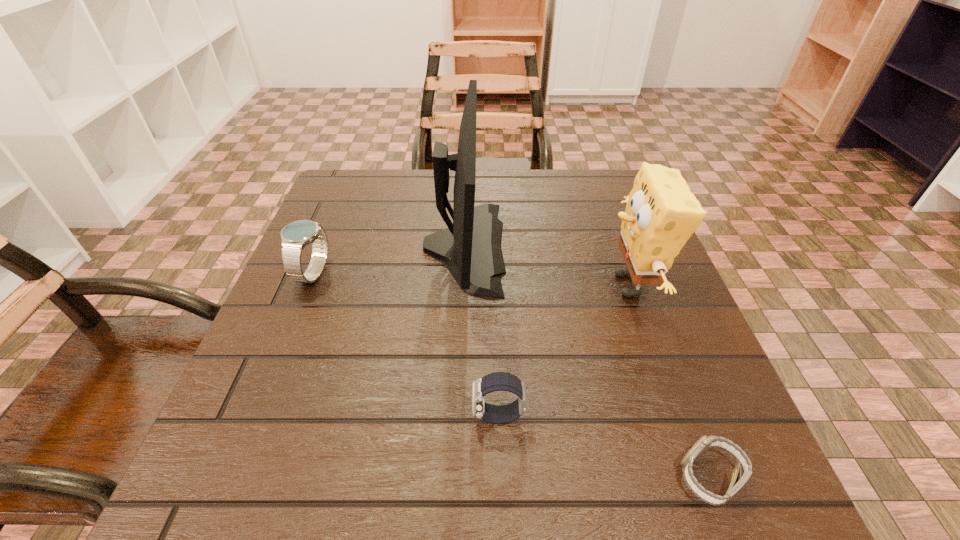
The image size is (960, 540). I want to click on the fourth closest object relative to the shortest object, so click(295, 236).

At what (x,y) coordinates should I click in order to perform the action: click on watch identified as the closest to the monitor. Please return your answer as a coordinate pair (x, y). The height and width of the screenshot is (540, 960). Looking at the image, I should click on (497, 381).

Identify which watch is located as the nearest to the leftmost watch. Please provide its 2D coordinates. Your answer should be formatted as a tuple, i.e. [(x, y)], where the tuple contains the x and y coordinates of a point satisfying the conditions above.

[(497, 381)]

The height and width of the screenshot is (540, 960). What are the coordinates of `vacant space that satisfies the following two spatial constraints: 1. on the screen side of the tallest object; 2. on the front side of the leftmost watch` in the screenshot? It's located at (463, 273).

Find the location of a particular element. The height and width of the screenshot is (540, 960). free space that satisfies the following two spatial constraints: 1. on the screen side of the tallest object; 2. on the front side of the leftmost object is located at coordinates (463, 273).